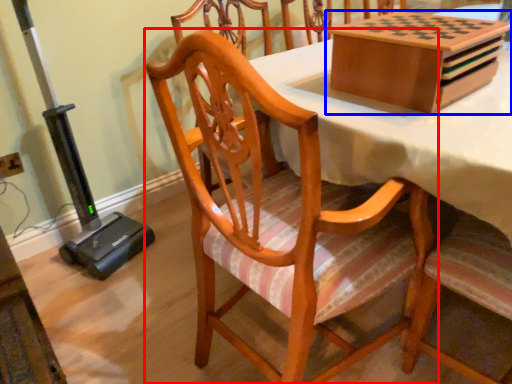
Question: Which object appears closest to the camera in this image, chair (highlighted by a red box) or cardboard box (highlighted by a blue box)?

Choices:
 (A) chair
 (B) cardboard box

Answer: (A)